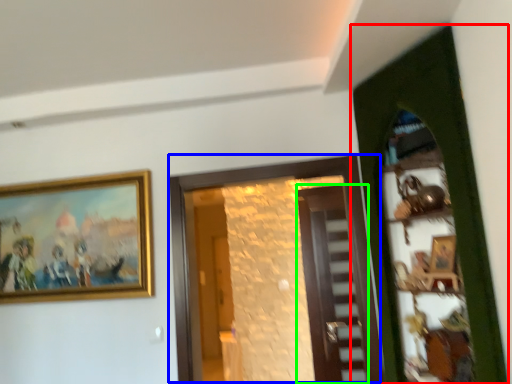
Question: Based on their relative distances, which object is farther from door (highlighted by a red box)? Choose from door (highlighted by a blue box) and door (highlighted by a green box).

Choices:
 (A) door
 (B) door

Answer: (B)